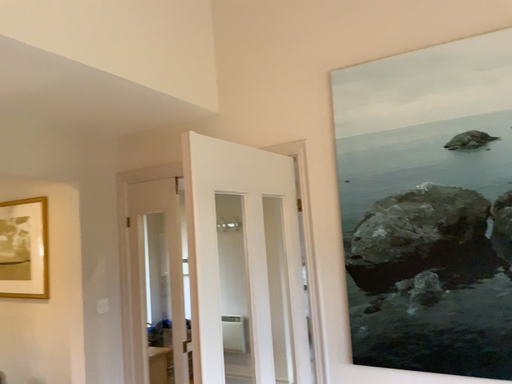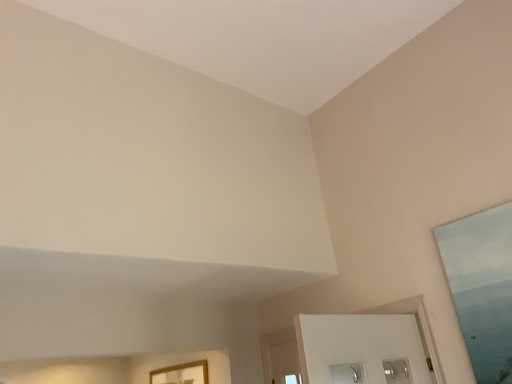
Question: Which way did the camera rotate in the video?

Choices:
 (A) rotated downward
 (B) rotated upward

Answer: (B)